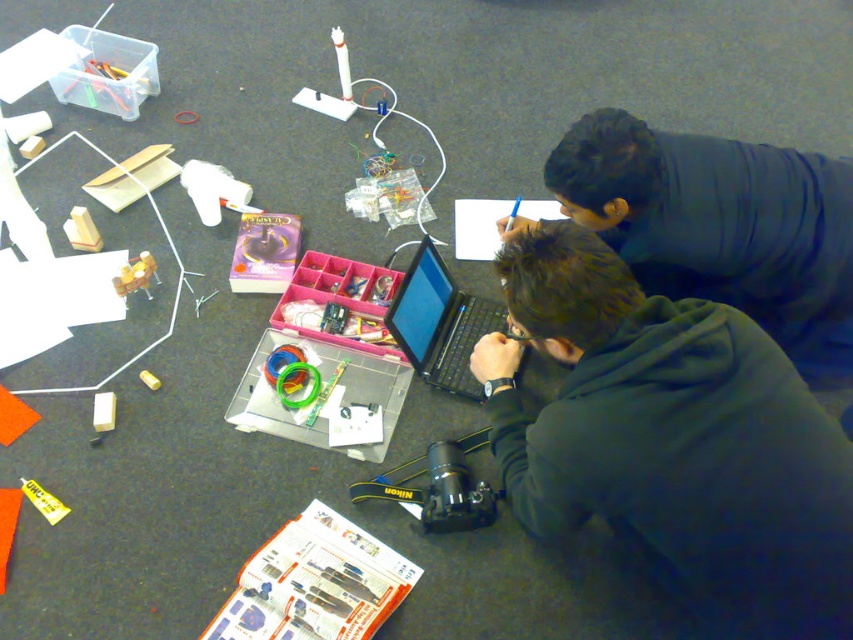
Question: Considering the real-world distances, which object is farthest from the dark gray hoodie at center?

Choices:
 (A) black matte laptop at center
 (B) dark blue hoodie at upper right

Answer: (A)

Question: Based on their relative distances, which object is nearer to the black matte laptop at center?

Choices:
 (A) dark blue hoodie at upper right
 (B) dark gray hoodie at center

Answer: (B)

Question: Does dark gray hoodie at center appear under dark blue hoodie at upper right?

Choices:
 (A) yes
 (B) no

Answer: (A)

Question: Does dark blue hoodie at upper right come in front of black matte laptop at center?

Choices:
 (A) no
 (B) yes

Answer: (B)

Question: Which of the following is the farthest from the observer?

Choices:
 (A) dark gray hoodie at center
 (B) dark blue hoodie at upper right

Answer: (B)

Question: Can you confirm if dark gray hoodie at center is positioned below black matte laptop at center?

Choices:
 (A) no
 (B) yes

Answer: (B)